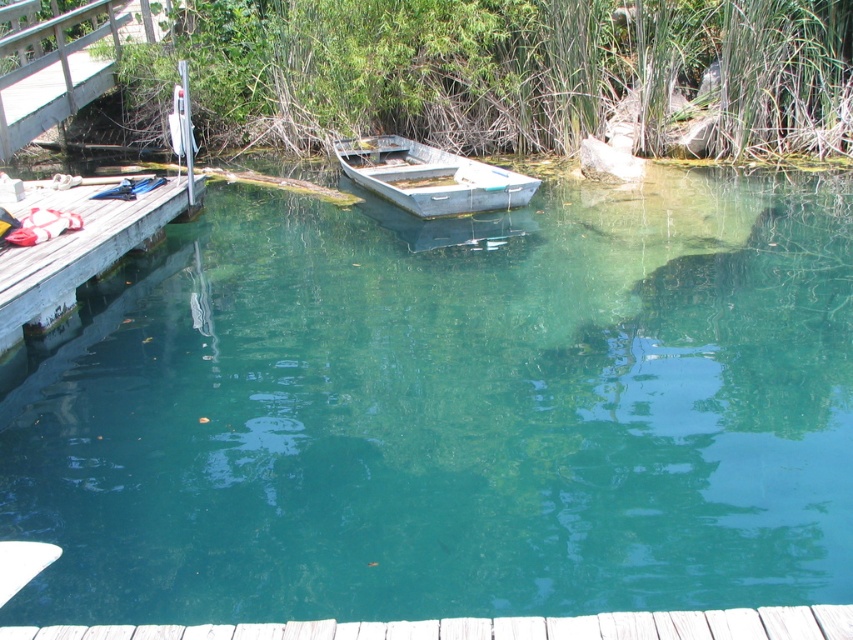
You are standing on the wooden dock at left and want to check the depth of the green translucent water at center. Based on the scene, can you estimate whether the water is deeper or shallower than the dock?

The green translucent water at center is much taller than the wooden dock at left, indicating that the water is deeper there.

You are standing on the wooden dock and looking towards the center of the image. Which object, the green translucent water at center or the metallic gray boat at center, is nearer to you?

The green translucent water at center is closer to the viewer than the metallic gray boat at center, so the green translucent water at center is nearer to you.

You are planning to walk from the wooden dock at left to the metallic gray boat at center. Which object has a narrower width to step on?

The wooden dock at left is thinner than the metallic gray boat at center, so it has a narrower width to step on.